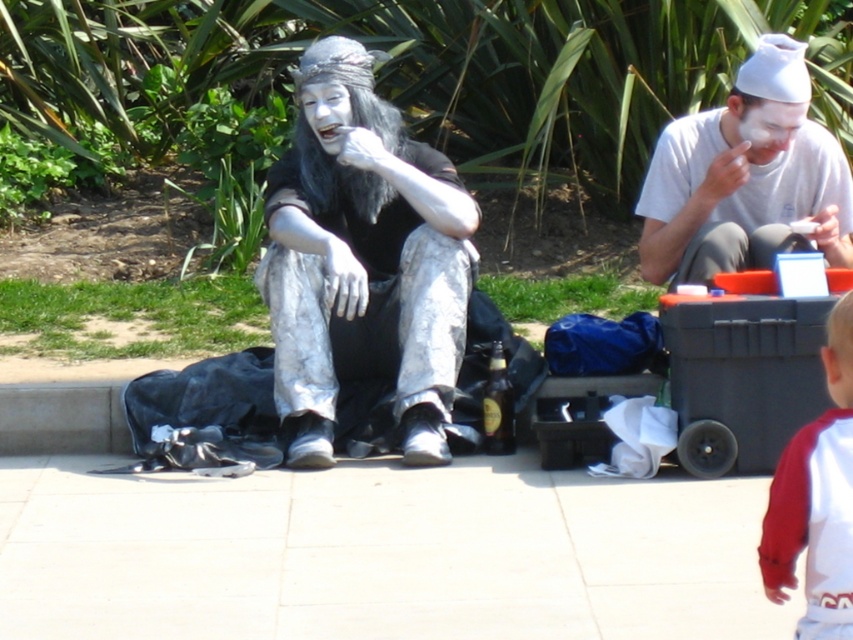
You are standing in the park and see two points marked in the image. Which point is closer to you, point (x=718, y=212) or point (x=834, y=385)?

Point (x=718, y=212) is closer to you because it is further to the viewer than point (x=834, y=385).

You are a photographer standing at the edge of the scene. You want to take a photo that includes both the white tile pavement at lower center and the white matte face paint at center. What is the minimum distance you need to move backward to ensure both are in frame?

The white tile pavement at lower center is 5.59 feet away from the white matte face paint at center. To capture both in the same frame, you need to move back at least 5.59 feet so that the distance between the two objects is within your camera lens range.

You are a photographer standing at the scene. You want to take a photo of the silver metallic face paint at center and the red jersey at lower right in the same frame. Given that your camera has a maximum focus range of 3 meters, will both subjects be in focus?

The silver metallic face paint at center is 3.11 meters away from the red jersey at lower right. Since the distance between them exceeds the camera maximum focus range of 3 meters, the two subjects cannot be in focus simultaneously.